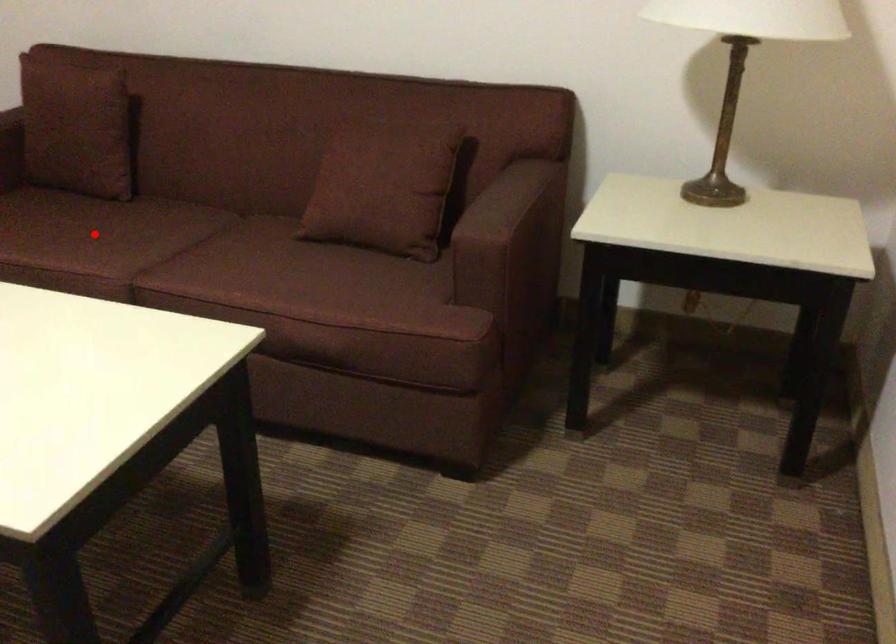
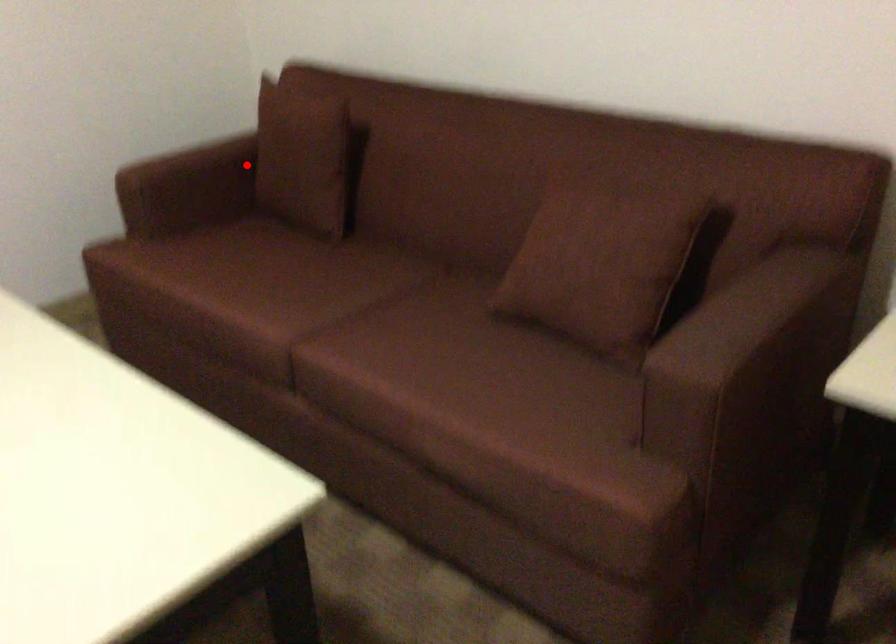
I am providing you with two images of the same scene from different viewpoints. A red point is marked on the first image and another point is marked on the second image. Is the marked point in image1 the same physical position as the marked point in image2?

No